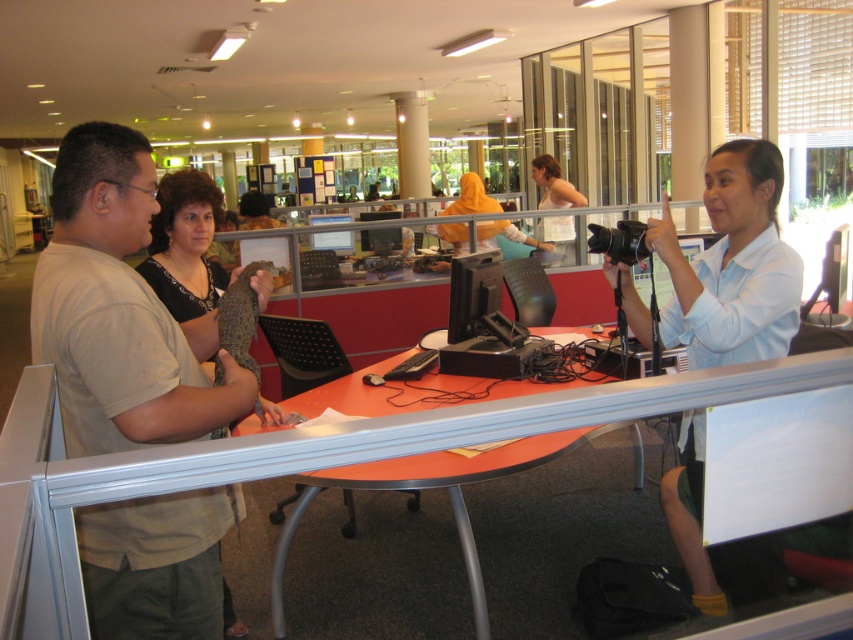
Does orange plastic table at center have a lesser height compared to light brown shirt at left?

Correct, orange plastic table at center is not as tall as light brown shirt at left.

Who is more distant from viewer, (570, 467) or (218, 353)?

Positioned behind is point (570, 467).

What do you see at coordinates (456, 538) in the screenshot?
I see `orange plastic table at center` at bounding box center [456, 538].

I want to click on orange plastic table at center, so [456, 538].

Does orange plastic table at center have a greater width compared to light blue shirt at right?

Indeed, orange plastic table at center has a greater width compared to light blue shirt at right.

Who is more forward, [428,600] or [749,566]?

Positioned in front is point [749,566].

You are a GUI agent. You are given a task and a screenshot of the screen. Output one action in this format:
    pyautogui.click(x=<x>, y=<y>)
    Task: Click on the orange plastic table at center
    Image resolution: width=853 pixels, height=640 pixels.
    Given the screenshot: What is the action you would take?
    pyautogui.click(x=456, y=538)

Is light brown shirt at left thinner than orange fabric headscarf at center?

Indeed, light brown shirt at left has a lesser width compared to orange fabric headscarf at center.

Looking at this image, who is higher up, light brown shirt at left or orange fabric headscarf at center?

orange fabric headscarf at center

Who is more distant from viewer, (206, 333) or (434, 234)?

The point (434, 234) is more distant.

The width and height of the screenshot is (853, 640). In order to click on light brown shirt at left in this screenshot , I will do `click(120, 310)`.